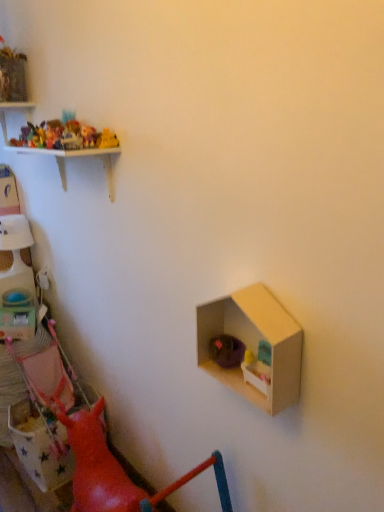
Question: From a real-world perspective, relative to plastic toys at upper left, the 1th toy viewed from the back, is plastic toy car at upper left, the second toy from the right, vertically above or below?

Choices:
 (A) below
 (B) above

Answer: (A)

Question: Is plastic toy car at upper left, marked as the 3th toy in a back-to-front arrangement, to the left or to the right of plastic toys at upper left, the 1th toy from the top, in the image?

Choices:
 (A) left
 (B) right

Answer: (B)

Question: Estimate the real-world distances between objects in this image. Which object is farther from the matte cardboard dollhouse at center right?

Choices:
 (A) plastic toy car at upper left, the second toy from the right
 (B) purple fabric basket at lower right, the first toy from the front
 (C) plastic toys at upper left, which is the second toy in top-to-bottom order
 (D) matte plastic toy box at left
 (E) plastic toys at upper left, the 4th toy when ordered from front to back

Answer: (D)

Question: Which is nearer to the plastic toys at upper left, arranged as the 1th toy when viewed from the left?

Choices:
 (A) purple fabric basket at lower right, which is the 1th toy from bottom to top
 (B) matte cardboard dollhouse at center right
 (C) matte plastic toy box at left
 (D) plastic toy car at upper left, positioned as the 3th toy in left-to-right order
 (E) plastic toys at upper left, the 1th toy viewed from the back

Answer: (E)